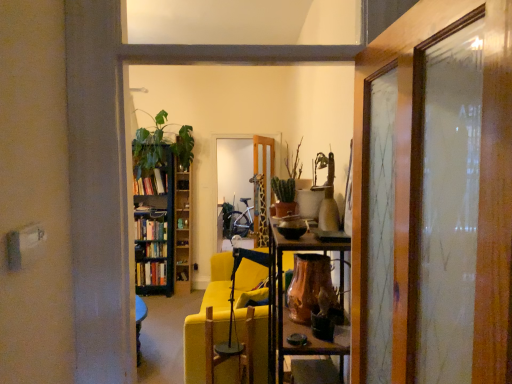
The height and width of the screenshot is (384, 512). What do you see at coordinates (308, 286) in the screenshot? I see `copper metallic vase at center` at bounding box center [308, 286].

Image resolution: width=512 pixels, height=384 pixels. Describe the element at coordinates (232, 352) in the screenshot. I see `wooden swivel chair at center` at that location.

Describe the element at coordinates (262, 187) in the screenshot. This screenshot has height=384, width=512. I see `glossy wooden door at center` at that location.

The image size is (512, 384). What are the coordinates of `metallic yellow chair at center` in the screenshot? It's located at (204, 329).

What do you see at coordinates (204, 329) in the screenshot? I see `metallic yellow chair at center` at bounding box center [204, 329].

At what (x,y) coordinates should I click in order to perform the action: click on green matte cactus at center, positioned as the 2th houseplant in front-to-back order. Please return your answer as a coordinate pair (x, y). This screenshot has width=512, height=384. Looking at the image, I should click on (287, 187).

From a real-world perspective, which is physically below, metallic yellow chair at center or green matte cactus at center, which is the first houseplant in front-to-back order?

metallic yellow chair at center.

How distant is metallic yellow chair at center from green matte cactus at center, the second houseplant viewed from the right?

metallic yellow chair at center is 3.99 feet away from green matte cactus at center, the second houseplant viewed from the right.

Which is closer to the camera, (x=214, y=329) or (x=281, y=186)?

Point (x=214, y=329) is positioned farther from the camera compared to point (x=281, y=186).

From the image's perspective, between wooden swivel chair at center and copper metallic vase at center, who is located below?

wooden swivel chair at center appears lower in the image.

Is wooden swivel chair at center looking in the opposite direction of copper metallic vase at center?

That's not correct — wooden swivel chair at center is not looking away from copper metallic vase at center.

Is point (243, 382) less distant than point (329, 284)?

No.

Would you say wooden swivel chair at center is outside copper metallic vase at center?

Absolutely, wooden swivel chair at center is external to copper metallic vase at center.

Considering the sizes of objects green matte cactus at center, which ranks as the second houseplant in back-to-front order, and green leafy plant at left, which is the 3th houseplant in front-to-back order, in the image provided, who is smaller, green matte cactus at center, which ranks as the second houseplant in back-to-front order, or green leafy plant at left, which is the 3th houseplant in front-to-back order,?

A: green matte cactus at center, which ranks as the second houseplant in back-to-front order, is smaller.

From the image's perspective, which one is positioned higher, green matte cactus at center, which is the 1th houseplant from right to left, or green leafy plant at left, which is the 3th houseplant in front-to-back order?

green leafy plant at left, which is the 3th houseplant in front-to-back order.

Consider the image. From their relative heights in the image, would you say green matte cactus at center, which ranks as the second houseplant in back-to-front order, is taller or shorter than green leafy plant at left, the third houseplant positioned from the right?

green matte cactus at center, which ranks as the second houseplant in back-to-front order, is shorter than green leafy plant at left, the third houseplant positioned from the right.

Is green matte cactus at center, which ranks as the second houseplant in back-to-front order, inside or outside of green leafy plant at left, arranged as the first houseplant when viewed from the left?

green matte cactus at center, which ranks as the second houseplant in back-to-front order, is outside green leafy plant at left, arranged as the first houseplant when viewed from the left.

Considering the relative sizes of wooden bookshelf at left and green leafy plant at left, arranged as the first houseplant when viewed from the left, in the image provided, is wooden bookshelf at left shorter than green leafy plant at left, arranged as the first houseplant when viewed from the left,?

In fact, wooden bookshelf at left may be taller than green leafy plant at left, arranged as the first houseplant when viewed from the left.

Considering their positions, is wooden bookshelf at left located in front of or behind green leafy plant at left, the third houseplant positioned from the right?

In the image, wooden bookshelf at left appears behind green leafy plant at left, the third houseplant positioned from the right.

From the image's perspective, which object appears higher, wooden bookshelf at left or green leafy plant at left, arranged as the first houseplant when viewed from the left?

green leafy plant at left, arranged as the first houseplant when viewed from the left, is shown above in the image.

How distant is wooden bookshelf at left from green leafy plant at left, the 1th houseplant when ordered from back to front?

wooden bookshelf at left and green leafy plant at left, the 1th houseplant when ordered from back to front, are 21.76 inches apart.

Is point (293, 194) positioned in front of point (294, 280)?

No, (293, 194) is further to viewer.

Which object is thinner, green matte cactus at center, which is counted as the third houseplant, starting from the back, or copper metallic vase at center?

green matte cactus at center, which is counted as the third houseplant, starting from the back.

Considering the sizes of green matte cactus at center, which is the first houseplant in front-to-back order, and copper metallic vase at center in the image, is green matte cactus at center, which is the first houseplant in front-to-back order, bigger or smaller than copper metallic vase at center?

In the image, green matte cactus at center, which is the first houseplant in front-to-back order, appears to be smaller than copper metallic vase at center.

In the image, is green matte bookcase at left positioned in front of or behind copper metallic vase at center?

Visually, green matte bookcase at left is located behind copper metallic vase at center.

How different are the orientations of green matte bookcase at left and copper metallic vase at center in degrees?

The angular difference between green matte bookcase at left and copper metallic vase at center is 89.7 degrees.

Does green matte bookcase at left have a greater width compared to copper metallic vase at center?

Yes, green matte bookcase at left is wider than copper metallic vase at center.

Who is bigger, green matte bookcase at left or copper metallic vase at center?

Bigger between the two is green matte bookcase at left.

From a real-world perspective, which object rests below the other?

metallic yellow chair at center.

Considering the relative sizes of green leafy plant at left, the third houseplant positioned from the right, and metallic yellow chair at center in the image provided, is green leafy plant at left, the third houseplant positioned from the right, bigger than metallic yellow chair at center?

Actually, green leafy plant at left, the third houseplant positioned from the right, might be smaller than metallic yellow chair at center.

Does green leafy plant at left, arranged as the first houseplant when viewed from the left, appear on the right side of metallic yellow chair at center?

In fact, green leafy plant at left, arranged as the first houseplant when viewed from the left, is to the left of metallic yellow chair at center.

Identify the location of houseplant that is the 1st object located above the metallic yellow chair at center (from the image's perspective). (284, 196).

Image resolution: width=512 pixels, height=384 pixels. I want to click on vase that is above the wooden swivel chair at center (from a real-world perspective), so click(308, 286).

When comparing their distances from glossy wooden door at center, does copper metallic vase at center or hardcover books at left, which ranks as the 1th book in bottom-to-top order, seem further?

The object further to glossy wooden door at center is copper metallic vase at center.

When comparing their distances from wooden bookshelf at left, does hardcover books at left, which ranks as the 1th book in bottom-to-top order, or wooden swivel chair at center seem closer?

hardcover books at left, which ranks as the 1th book in bottom-to-top order, is positioned closer to the anchor wooden bookshelf at left.

Based on their spatial positions, is green leafy plant at left, arranged as the first houseplant when viewed from the left, or glossy wooden door at center closer to wooden swivel chair at center?

Among the two, glossy wooden door at center is located nearer to wooden swivel chair at center.

Looking at the image, which one is located closer to wooden swivel chair at center, wooden bookshelf at left or green matte cactus at center, the second houseplant viewed from the right?

green matte cactus at center, the second houseplant viewed from the right, is positioned closer to the anchor wooden swivel chair at center.

When comparing their distances from glossy wooden door at center, does green matte cactus at center, which is the first houseplant in front-to-back order, or wooden swivel chair at center seem further?

wooden swivel chair at center lies further to glossy wooden door at center than the other object.

Based on their spatial positions, is wooden bookshelf at left or metallic yellow chair at center further from green matte cactus at center, which is the first houseplant in front-to-back order?

Based on the image, wooden bookshelf at left appears to be further to green matte cactus at center, which is the first houseplant in front-to-back order.

Based on their spatial positions, is wooden swivel chair at center or green matte cactus at center, which appears as the 2th houseplant when viewed from the left, further from green matte cactus at center, arranged as the 3th houseplant when viewed from the left?

The object further to green matte cactus at center, arranged as the 3th houseplant when viewed from the left, is wooden swivel chair at center.

Based on their spatial positions, is hardcover books at left, which appears as the first book when viewed from the top, or green matte cactus at center, positioned as the 2th houseplant in front-to-back order, further from copper metallic vase at center?

hardcover books at left, which appears as the first book when viewed from the top, is further to copper metallic vase at center.

Find the location of a particular element. The image size is (512, 384). door between copper metallic vase at center and hardcover books at left, which ranks as the 1th book in bottom-to-top order, along the z-axis is located at coordinates (262, 187).

The width and height of the screenshot is (512, 384). In order to click on swivel chair located between copper metallic vase at center and metallic yellow chair at center in the depth direction in this screenshot , I will do click(232, 352).

Where is `door between metallic yellow chair at center and hardcover books at left, which is the 2th book from top to bottom, in the front-back direction`? The image size is (512, 384). door between metallic yellow chair at center and hardcover books at left, which is the 2th book from top to bottom, in the front-back direction is located at coordinates (262, 187).

The image size is (512, 384). What are the coordinates of `houseplant between metallic yellow chair at center and hardcover books at left, which appears as the first book when viewed from the top, in the front-back direction` in the screenshot? It's located at (150, 145).